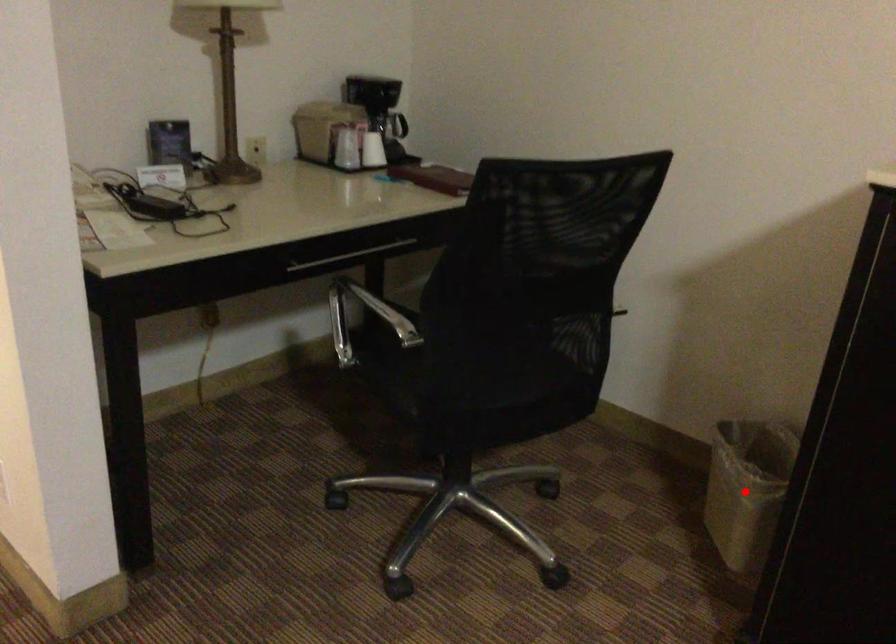
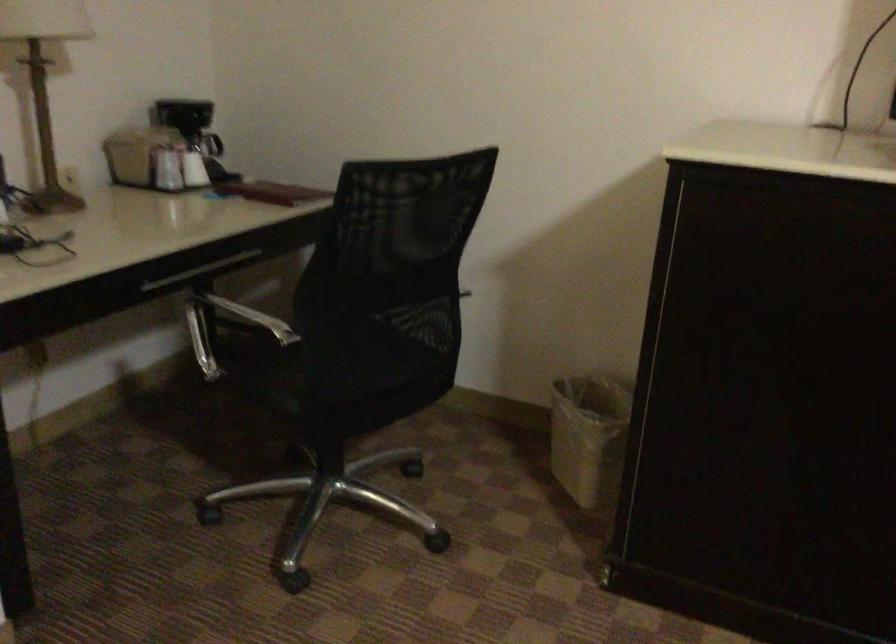
Find the pixel in the second image that matches the highlighted location in the first image.

(589, 437)